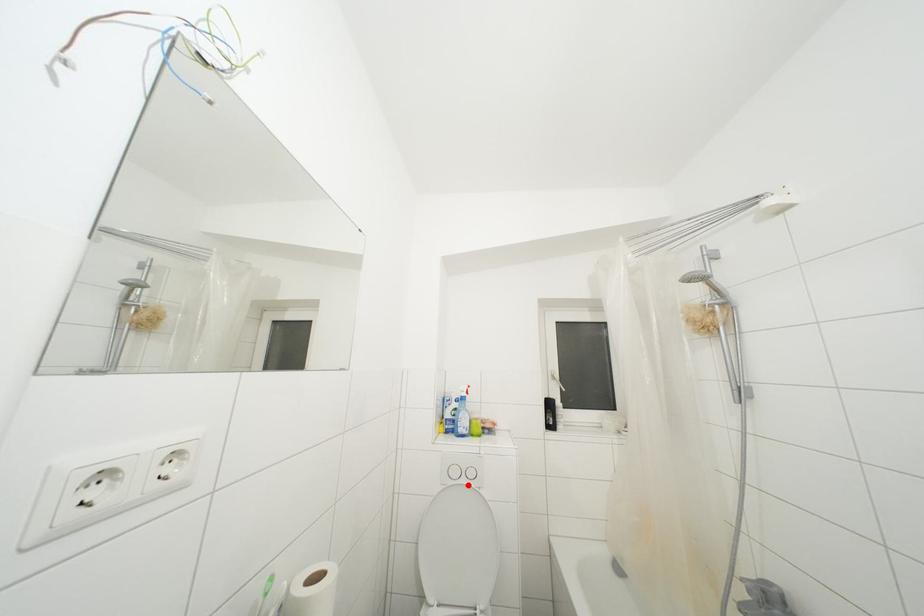
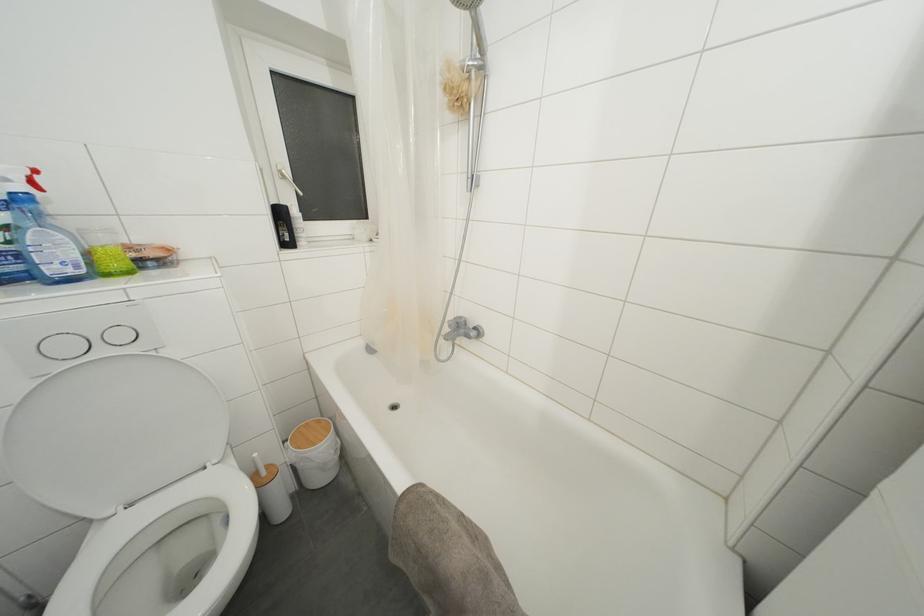
Where in the second image is the point corresponding to the highlighted location from the first image?

(106, 357)